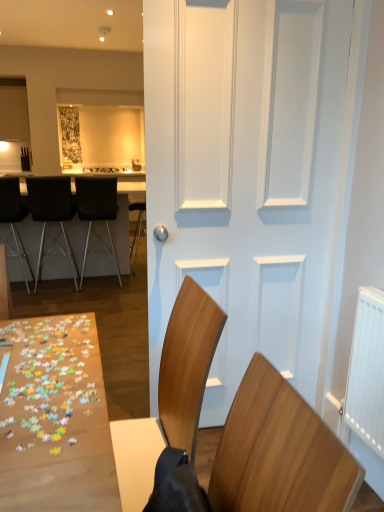
Question: Can you confirm if wooden chair at lower right, placed as the fourth chair when sorted from left to right, is taller than black leather chair at left, which is the 2th chair from left to right?

Choices:
 (A) yes
 (B) no

Answer: (B)

Question: Considering the relative sizes of wooden chair at lower right, placed as the fourth chair when sorted from left to right, and black leather chair at left, which is the 2th chair from left to right, in the image provided, is wooden chair at lower right, placed as the fourth chair when sorted from left to right, wider than black leather chair at left, which is the 2th chair from left to right,?

Choices:
 (A) no
 (B) yes

Answer: (A)

Question: Considering the relative sizes of wooden chair at lower right, the fourth chair viewed from the back, and black leather chair at left, which is the third chair in right-to-left order, in the image provided, is wooden chair at lower right, the fourth chair viewed from the back, bigger than black leather chair at left, which is the third chair in right-to-left order,?

Choices:
 (A) no
 (B) yes

Answer: (A)

Question: Can we say wooden chair at lower right, the first chair in the right-to-left sequence, lies outside black leather chair at left, which is the third chair in right-to-left order?

Choices:
 (A) no
 (B) yes

Answer: (B)

Question: Is wooden chair at lower right, the fourth chair viewed from the back, closer to camera compared to black leather chair at left, which is the third chair in right-to-left order?

Choices:
 (A) no
 (B) yes

Answer: (B)

Question: From their relative heights in the image, would you say black leather table at left is taller or shorter than white matte door at center?

Choices:
 (A) tall
 (B) short

Answer: (B)

Question: Based on their sizes in the image, would you say black leather table at left is bigger or smaller than white matte door at center?

Choices:
 (A) small
 (B) big

Answer: (B)

Question: Considering their positions, is black leather table at left located in front of or behind white matte door at center?

Choices:
 (A) front
 (B) behind

Answer: (B)

Question: In the image, is black leather table at left on the left side or the right side of white matte door at center?

Choices:
 (A) right
 (B) left

Answer: (B)

Question: In terms of height, does black leather chair at left, which is counted as the second chair, starting from the back, look taller or shorter compared to black leather chair at center, which is counted as the 4th chair, starting from the front?

Choices:
 (A) tall
 (B) short

Answer: (A)

Question: Considering the relative positions of black leather chair at left, which is the 2th chair from left to right, and black leather chair at center, which is counted as the third chair, starting from the left, in the image provided, is black leather chair at left, which is the 2th chair from left to right, to the left or to the right of black leather chair at center, which is counted as the third chair, starting from the left,?

Choices:
 (A) left
 (B) right

Answer: (A)

Question: From the image's perspective, is black leather chair at left, the third chair viewed from the front, above or below black leather chair at center, acting as the second chair starting from the right?

Choices:
 (A) above
 (B) below

Answer: (B)

Question: Based on their sizes in the image, would you say black leather chair at left, the third chair viewed from the front, is bigger or smaller than black leather chair at center, which is the first chair from back to front?

Choices:
 (A) big
 (B) small

Answer: (B)

Question: From the image's perspective, is black leather chair at center, which is counted as the 4th chair, starting from the front, located above or below black metal bar stool at left, which is the 3th chair in back-to-front order?

Choices:
 (A) above
 (B) below

Answer: (A)

Question: Considering the positions of black leather chair at center, which is counted as the third chair, starting from the left, and black metal bar stool at left, which is the 3th chair in back-to-front order, in the image, is black leather chair at center, which is counted as the third chair, starting from the left, taller or shorter than black metal bar stool at left, which is the 3th chair in back-to-front order,?

Choices:
 (A) short
 (B) tall

Answer: (A)